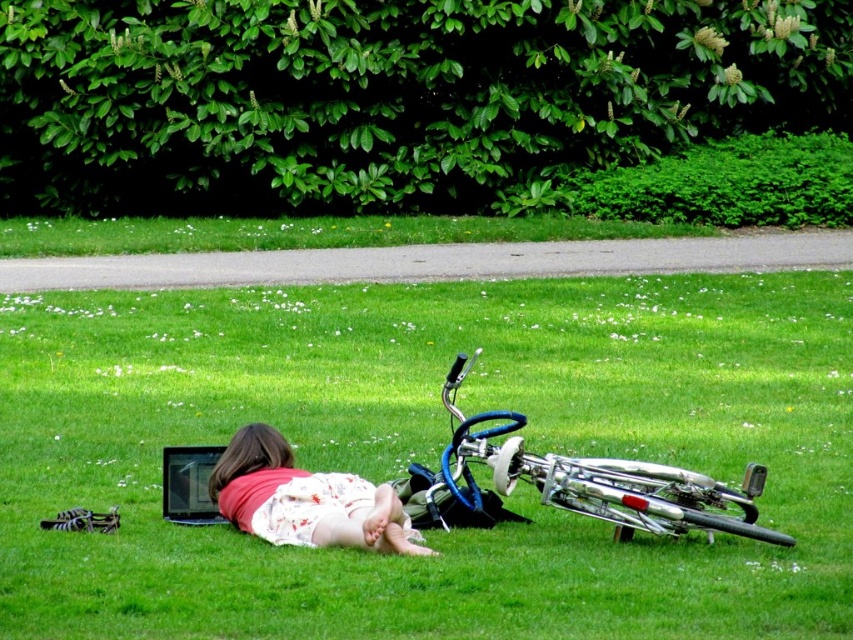
Between green grass at center and floral dress at center, which one is positioned lower?

floral dress at center is lower down.

Describe the element at coordinates (428, 452) in the screenshot. I see `green grass at center` at that location.

The image size is (853, 640). What do you see at coordinates (428, 452) in the screenshot?
I see `green grass at center` at bounding box center [428, 452].

Locate an element on the screen. The height and width of the screenshot is (640, 853). green grass at center is located at coordinates (428, 452).

Does green grass at center come behind silver metallic bicycle at lower center?

No, green grass at center is in front of silver metallic bicycle at lower center.

Can you confirm if green grass at center is wider than silver metallic bicycle at lower center?

Correct, the width of green grass at center exceeds that of silver metallic bicycle at lower center.

Describe the element at coordinates (428, 452) in the screenshot. I see `green grass at center` at that location.

Find the location of `green grass at center`. green grass at center is located at coordinates (428, 452).

Between silver metallic bicycle at lower center and floral dress at center, which one has less height?

floral dress at center is shorter.

Can you confirm if silver metallic bicycle at lower center is positioned to the right of floral dress at center?

Indeed, silver metallic bicycle at lower center is positioned on the right side of floral dress at center.

Is point (737, 502) positioned after point (238, 528)?

No, (737, 502) is in front of (238, 528).

At what (x,y) coordinates should I click in order to perform the action: click on silver metallic bicycle at lower center. Please return your answer as a coordinate pair (x, y). Looking at the image, I should click on (587, 480).